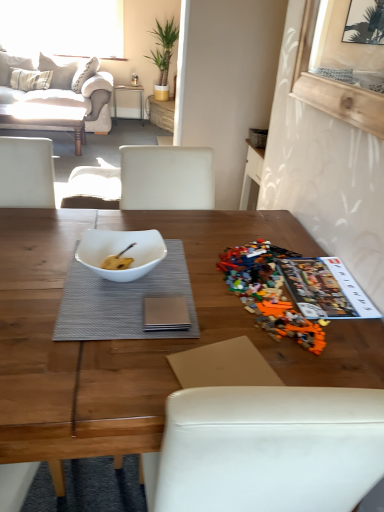
Image resolution: width=384 pixels, height=512 pixels. Identify the location of unoccupied region to the right of white glossy bowl at center. point(198,281).